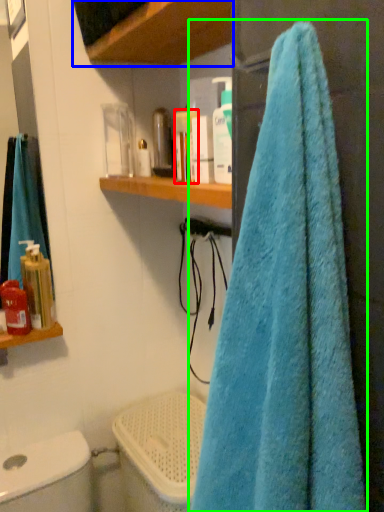
Question: Which object is positioned closest to toiletry (highlighted by a red box)? Select from shelf (highlighted by a blue box) and towel (highlighted by a green box).

Choices:
 (A) shelf
 (B) towel

Answer: (A)